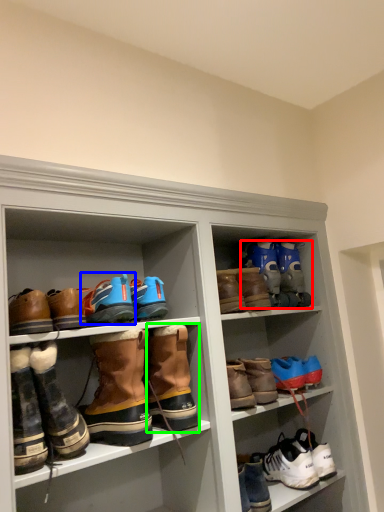
Question: Which object is the farthest from footwear (highlighted by a red box)? Choose among these: footwear (highlighted by a blue box) or footwear (highlighted by a green box).

Choices:
 (A) footwear
 (B) footwear

Answer: (A)